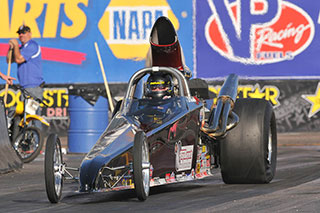
At what (x,y) coordinates should I click in order to perform the action: click on black trash bag. Please return your answer as a coordinate pair (x, y). Looking at the image, I should click on (90, 94).